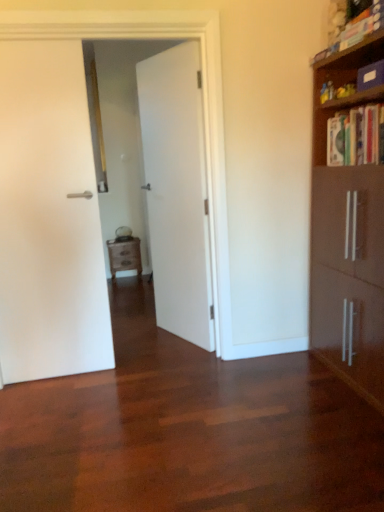
This screenshot has height=512, width=384. Identify the location of free space in front of white matte door at left, arranged as the first door when viewed from the left. (58, 408).